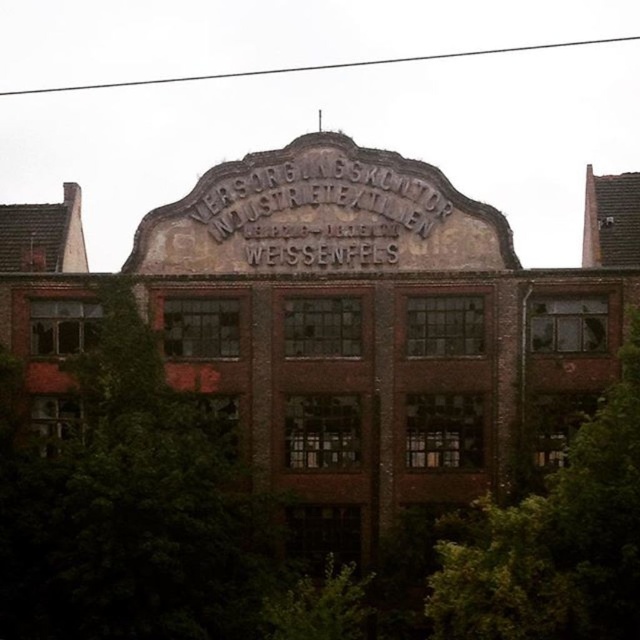
You are a gardener assessing the trees in front of the old factory. Which tree, the green leafy tree at left or the green leafy tree at center, has a wider spread?

The green leafy tree at left has a wider spread than the green leafy tree at center because its width surpasses the latter.

You are standing in front of the old brick building and notice the green leafy tree at left and the black metal sign at center. Which object is taller?

The green leafy tree at left is taller than the black metal sign at center.

You are standing in front of the old brick building and notice a green leafy tree at center and a black metal sign at center. Which object is taller?

The green leafy tree at center is taller than the black metal sign at center.